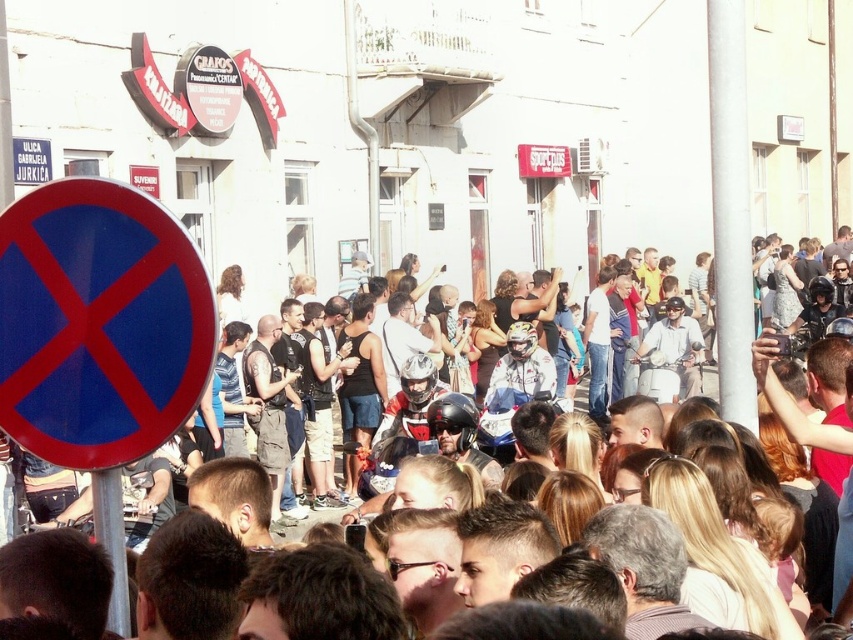
Question: Which object is positioned closest to the blue circular sign at left?

Choices:
 (A) brown hair at center
 (B) silver metallic pole at upper right
 (C) blue glossy sign at left

Answer: (A)

Question: Based on their relative distances, which object is nearer to the silver metallic pole at upper right?

Choices:
 (A) blue glossy sign at left
 (B) brown hair at center
 (C) blue circular sign at left

Answer: (B)

Question: Can you confirm if silver metallic pole at upper right is positioned to the left of blue circular sign at left?

Choices:
 (A) yes
 (B) no

Answer: (B)

Question: Is blue glossy sign at left above silver metallic pole at upper right?

Choices:
 (A) no
 (B) yes

Answer: (A)

Question: Which point is closer to the camera taking this photo?

Choices:
 (A) (747, 401)
 (B) (80, 500)
 (C) (25, 260)

Answer: (C)

Question: Is blue glossy sign at left bigger than silver metallic pole at upper right?

Choices:
 (A) yes
 (B) no

Answer: (B)